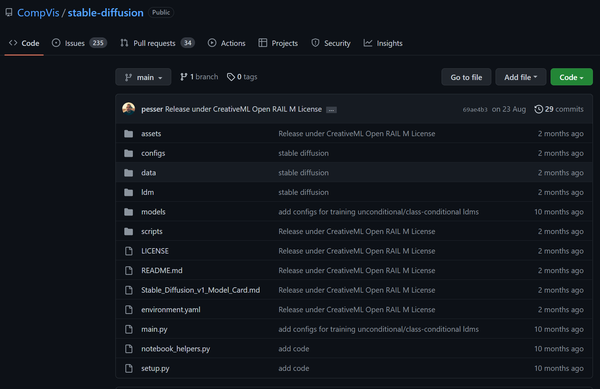
Locate an element on the screen. Image resolution: width=600 pixels, height=389 pixels. files is located at coordinates (210, 373), (208, 352), (188, 327), (188, 310), (182, 290), (169, 273), (159, 247).